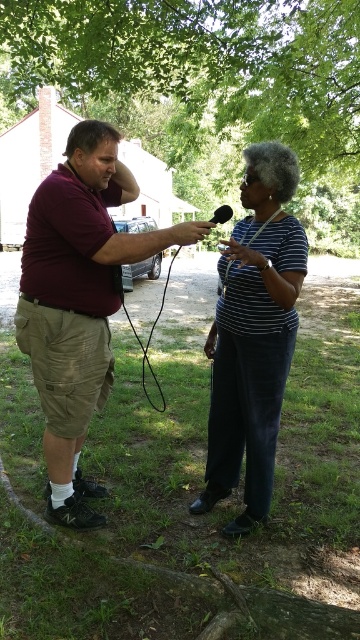
You are a photographer at the interview scene. You need to ensure both the striped fabric shirt at center and the black matte microphone at center are clearly visible in your photo. Given their sizes, which object might require you to adjust your camera focus more carefully to avoid blurriness?

The striped fabric shirt at center has a smaller size compared to the black matte microphone at center, so you might need to adjust the camera focus more carefully on the striped fabric shirt at center to ensure its details are clear.

You are a photographer at the interview scene. You need to ensure that the striped fabric shirt at center and the black matte microphone at center are both visible in the photo. Given their relative sizes, which object should you focus on to frame the shot properly?

The striped fabric shirt at center is shorter than the black matte microphone at center, so you should focus on the black matte microphone at center to ensure both objects are visible in the photo.

You are a photographer positioned behind the black matte microphone at center, aiming to capture a clear shot of the green leafy tree at upper center. Can you see the tree without any obstruction from the microphone?

The green leafy tree at upper center is further to the viewer than the black matte microphone at center, meaning the microphone is between you and the tree. This would block your view of the tree, so you cannot see it clearly without moving the microphone.